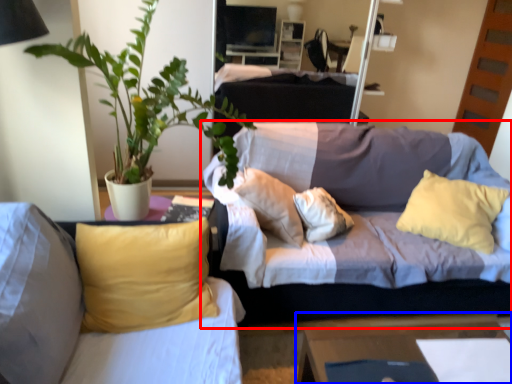
Question: Which point is closer to the camera, studio couch (highlighted by a red box) or table (highlighted by a blue box)?

Choices:
 (A) studio couch
 (B) table

Answer: (B)